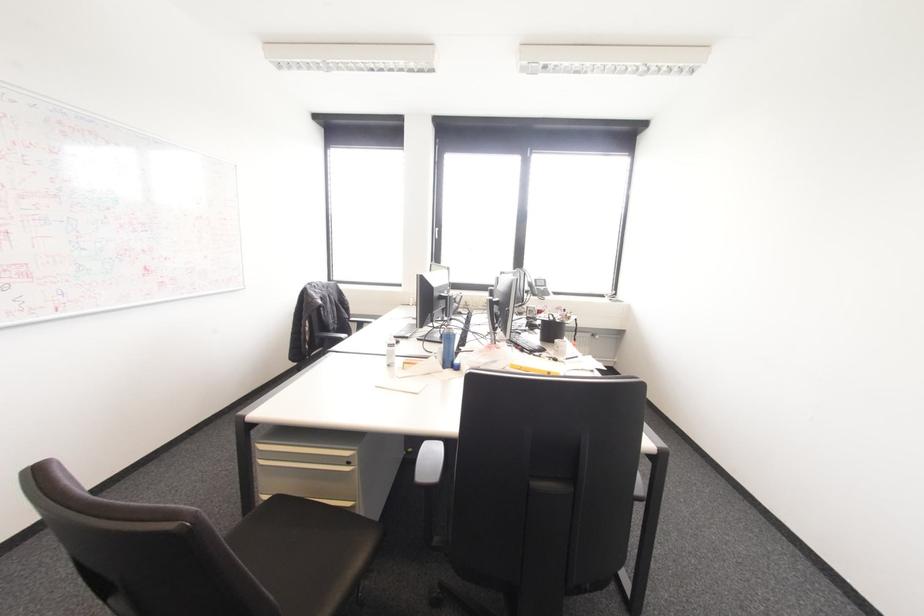
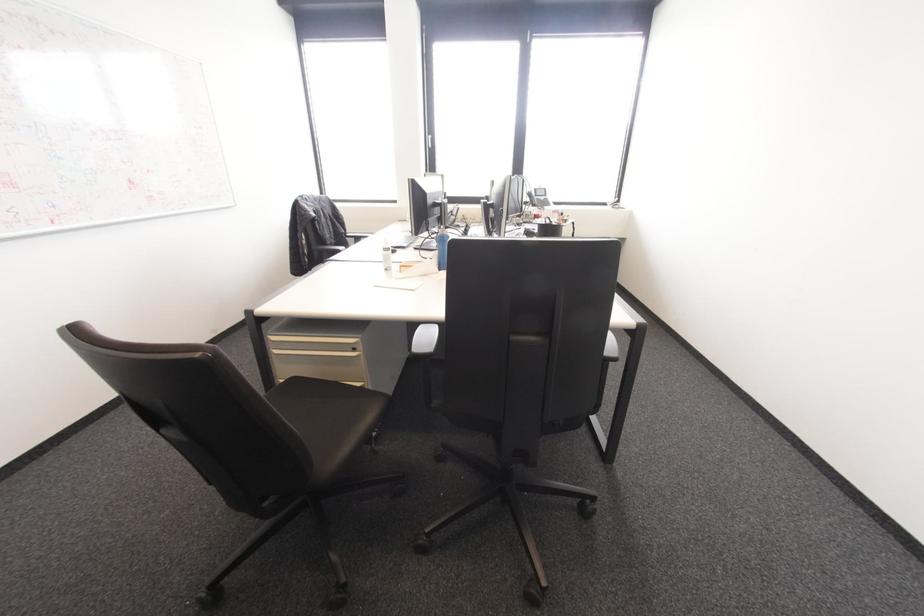
In the second image, find the point that corresponds to pixel 444 367 in the first image.

(440, 270)